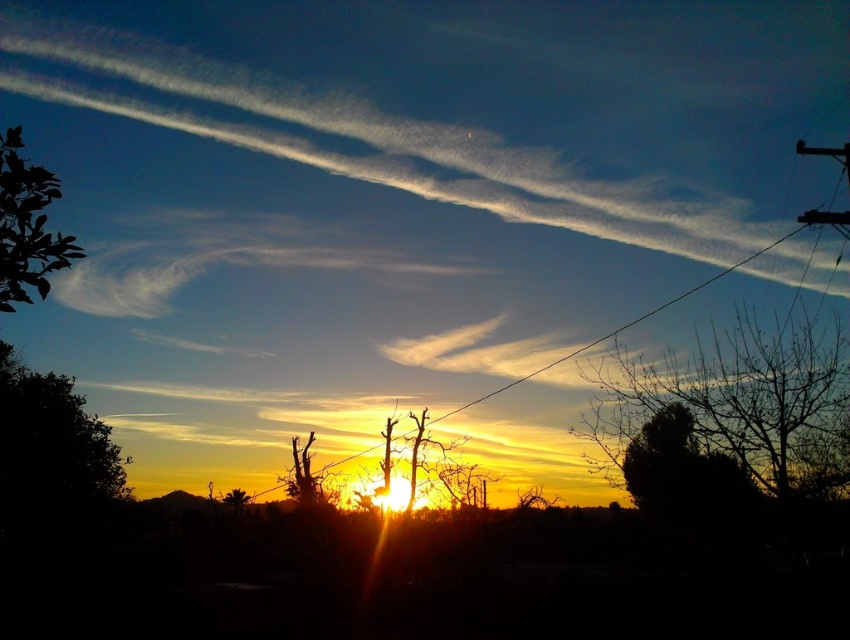
Question: Considering the relative positions of green leafy tree at upper left and black wire at center in the image provided, where is green leafy tree at upper left located with respect to black wire at center?

Choices:
 (A) right
 (B) left

Answer: (B)

Question: Which object appears closest to the camera in this image?

Choices:
 (A) white wispy cloud at upper center
 (B) silhouette bare tree at right

Answer: (B)

Question: Is white wispy cloud at upper center to the right of dark green leafy tree at lower left from the viewer's perspective?

Choices:
 (A) yes
 (B) no

Answer: (A)

Question: Does white wispy cloud at upper center have a smaller size compared to dark green leafy tree at lower left?

Choices:
 (A) no
 (B) yes

Answer: (A)

Question: Which of the following is the closest to the observer?

Choices:
 (A) (136, 100)
 (B) (290, 474)

Answer: (B)

Question: Which object appears closest to the camera in this image?

Choices:
 (A) white wispy cloud at upper center
 (B) brown textured tree at center
 (C) green leafy tree at upper left

Answer: (C)